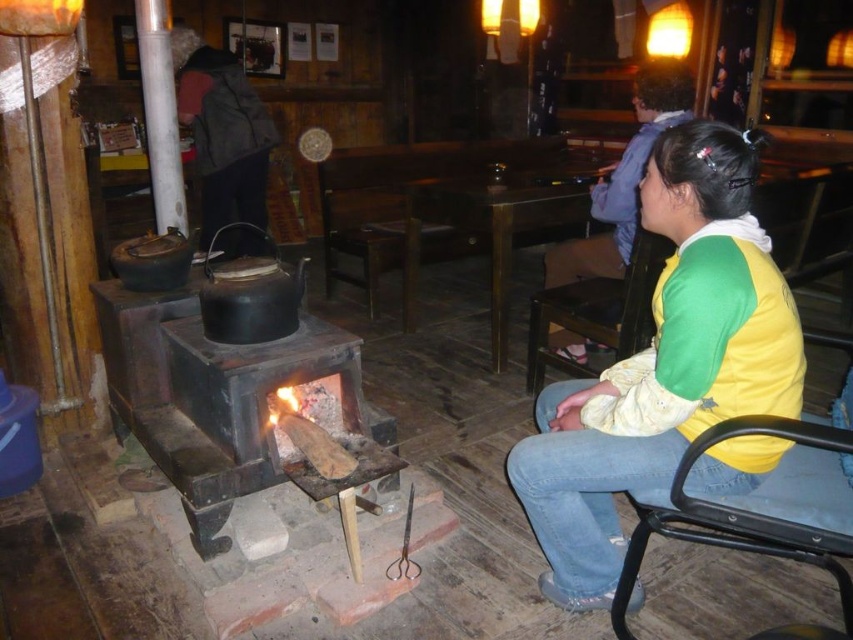
Question: Estimate the real-world distances between objects in this image. Which object is closer to the yellow-green jacket at right?

Choices:
 (A) dark gray jacket at upper left
 (B) yellow-green fabric chair at lower right
 (C) black plastic chair at lower right
 (D) yellow-green fabric jacket at lower right

Answer: (B)

Question: Which object is the closest to the yellow-green fabric jacket at lower right?

Choices:
 (A) black plastic chair at lower right
 (B) dark gray jacket at upper left

Answer: (A)

Question: Is black plastic chair at lower right wider than yellow-green jacket at right?

Choices:
 (A) no
 (B) yes

Answer: (A)

Question: Can you confirm if black plastic chair at lower right is bigger than yellow-green jacket at right?

Choices:
 (A) yes
 (B) no

Answer: (B)

Question: Which point is farther to the camera?

Choices:
 (A) (689, 532)
 (B) (569, 256)
 (C) (213, 54)
 (D) (605, 349)

Answer: (C)

Question: Can you confirm if black plastic chair at lower right is smaller than dark gray jacket at upper left?

Choices:
 (A) no
 (B) yes

Answer: (B)